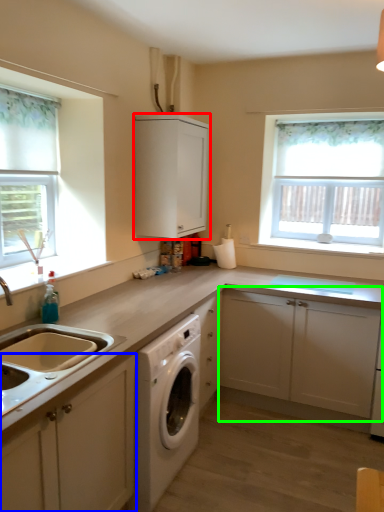
Question: Which object is positioned farthest from cabinetry (highlighted by a red box)? Select from cabinetry (highlighted by a blue box) and cabinetry (highlighted by a green box).

Choices:
 (A) cabinetry
 (B) cabinetry

Answer: (A)